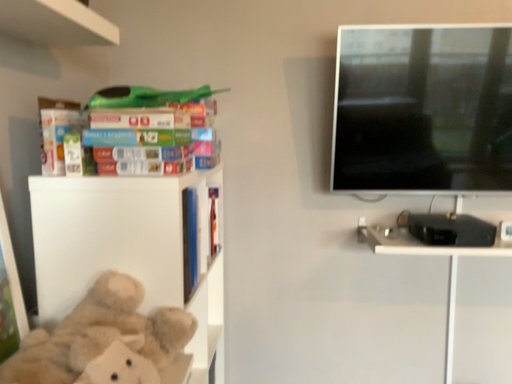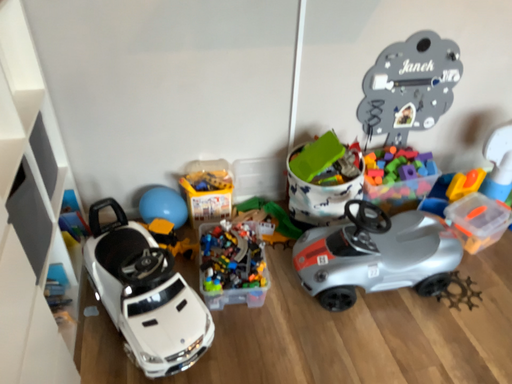
Question: How did the camera likely rotate when shooting the video?

Choices:
 (A) rotated left
 (B) rotated right

Answer: (B)